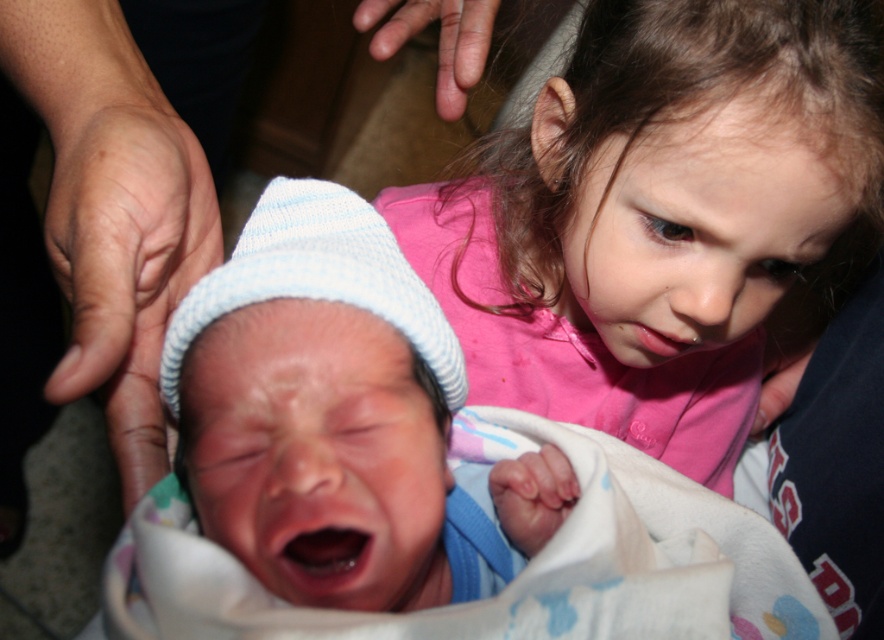
You are designing a gift box for a baby shower. The box has two compartments. The first compartment must fit the blue knit hat at center, and the second must fit the pink cotton shirt at upper right. Based on the provided information, which compartment should be wider?

The second compartment should be wider because the pink cotton shirt at upper right is wider than the blue knit hat at center.

You are a photographer trying to capture a closeup of the blue knit hat at center and the pink cotton shirt at upper right in the scene. Since you want both objects to be in focus, you need to know which one is closer to you. Based on the scene description, which object is closer?

The blue knit hat at center is shorter than pink cotton shirt at upper right, so the blue knit hat at center is closer to you.